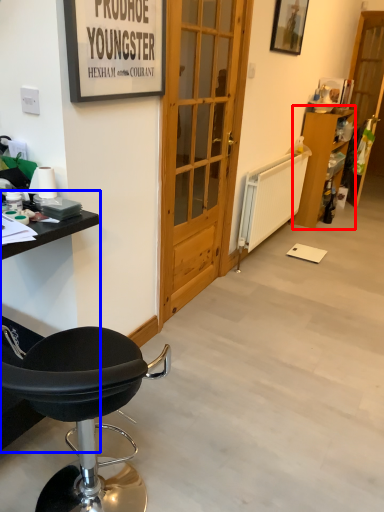
Question: Which point is closer to the camera, cabinetry (highlighted by a red box) or table (highlighted by a blue box)?

Choices:
 (A) cabinetry
 (B) table

Answer: (B)